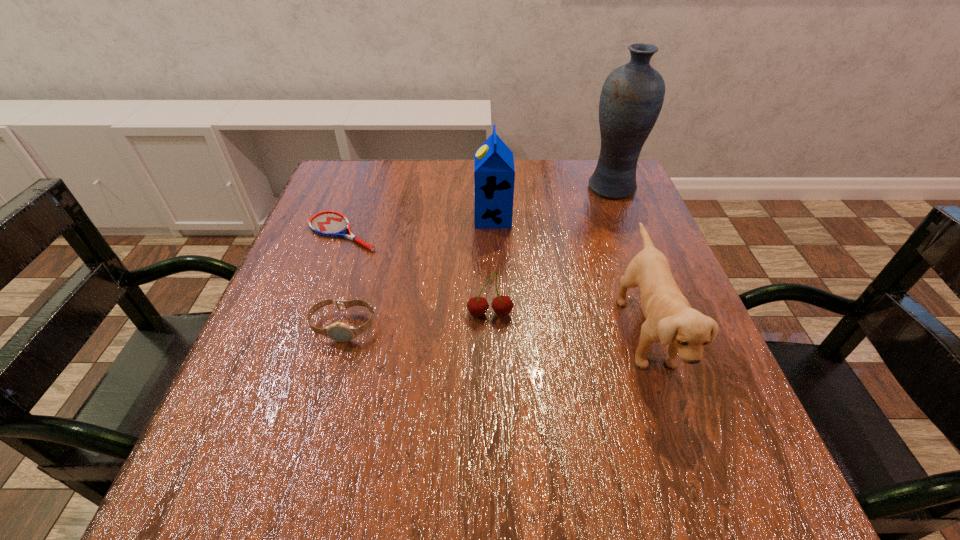
Image resolution: width=960 pixels, height=540 pixels. I want to click on vacant space in between the fourth shortest object and the fourth tallest object, so click(567, 323).

Where is `empty location between the farthest object and the puppy`? empty location between the farthest object and the puppy is located at coordinates (628, 260).

At what (x,y) coordinates should I click in order to perform the action: click on vacant area that lies between the fourth shortest object and the third shortest object. Please return your answer as a coordinate pair (x, y). This screenshot has width=960, height=540. Looking at the image, I should click on (567, 323).

Identify the location of vacant space that is in between the tallest object and the second tallest object. (552, 202).

Where is `vacant point located between the fifth shortest object and the third shortest object`? The image size is (960, 540). vacant point located between the fifth shortest object and the third shortest object is located at coordinates (492, 266).

Image resolution: width=960 pixels, height=540 pixels. Identify the location of empty space between the puppy and the shortest object. (494, 282).

Find the location of a particular element. empty location between the tennis racket and the fourth shortest object is located at coordinates (494, 282).

Locate an element on the screen. This screenshot has width=960, height=540. free space between the carton and the tallest object is located at coordinates (552, 202).

I want to click on object that stands as the closest to the carton, so click(632, 96).

Locate which object ranks fifth in proximity to the fourth tallest object. Please provide its 2D coordinates. Your answer should be formatted as a tuple, i.e. [(x, y)], where the tuple contains the x and y coordinates of a point satisfying the conditions above.

[(632, 96)]